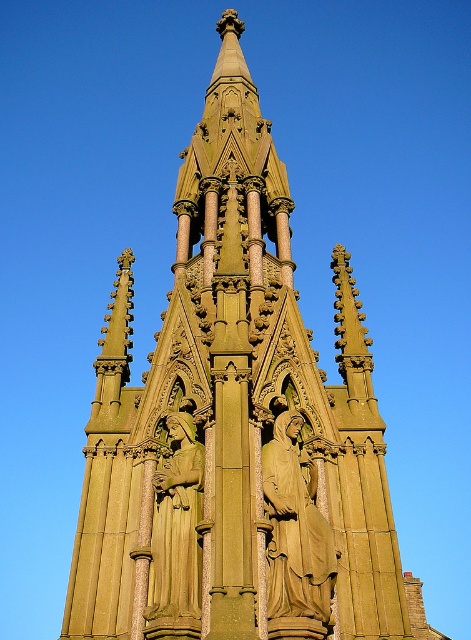
Between golden stone statue at center and green stone statue at center, which one appears on the left side from the viewer's perspective?

From the viewer's perspective, green stone statue at center appears more on the left side.

Does golden stone statue at center have a lesser width compared to green stone statue at center?

In fact, golden stone statue at center might be wider than green stone statue at center.

This screenshot has width=471, height=640. What do you see at coordinates (295, 536) in the screenshot?
I see `golden stone statue at center` at bounding box center [295, 536].

Where is `golden stone statue at center`? The width and height of the screenshot is (471, 640). golden stone statue at center is located at coordinates (295, 536).